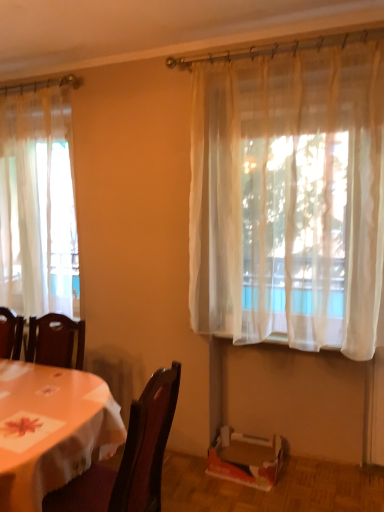
Question: From the image's perspective, would you say sheer white curtain at upper right, acting as the 1th curtain starting from the right, is positioned over sheer white curtain at left, which appears as the 2th curtain when viewed from the front?

Choices:
 (A) no
 (B) yes

Answer: (A)

Question: Is sheer white curtain at upper right, acting as the 1th curtain starting from the right, located outside sheer white curtain at left, positioned as the 2th curtain in right-to-left order?

Choices:
 (A) yes
 (B) no

Answer: (A)

Question: Can you confirm if sheer white curtain at upper right, which is the 2th curtain from left to right, is wider than sheer white curtain at left, which appears as the 2th curtain when viewed from the front?

Choices:
 (A) yes
 (B) no

Answer: (B)

Question: Can you confirm if sheer white curtain at upper right, which is the 2th curtain from left to right, is thinner than sheer white curtain at left, marked as the first curtain in a back-to-front arrangement?

Choices:
 (A) yes
 (B) no

Answer: (A)

Question: Is sheer white curtain at upper right, the 1th curtain positioned from the front, touching sheer white curtain at left, which appears as the 2th curtain when viewed from the front?

Choices:
 (A) yes
 (B) no

Answer: (B)

Question: Considering the relative positions of sheer white curtain at upper right, placed as the second curtain when sorted from back to front, and sheer white curtain at left, marked as the first curtain in a back-to-front arrangement, in the image provided, is sheer white curtain at upper right, placed as the second curtain when sorted from back to front, to the left of sheer white curtain at left, marked as the first curtain in a back-to-front arrangement, from the viewer's perspective?

Choices:
 (A) yes
 (B) no

Answer: (B)

Question: Does cardboard box at lower right have a larger size compared to wooden table at lower left?

Choices:
 (A) yes
 (B) no

Answer: (B)

Question: Is cardboard box at lower right touching wooden table at lower left?

Choices:
 (A) no
 (B) yes

Answer: (A)

Question: From the image's perspective, does cardboard box at lower right appear lower than wooden table at lower left?

Choices:
 (A) yes
 (B) no

Answer: (A)

Question: Considering the relative sizes of cardboard box at lower right and wooden table at lower left in the image provided, is cardboard box at lower right taller than wooden table at lower left?

Choices:
 (A) yes
 (B) no

Answer: (B)

Question: From the image's perspective, is cardboard box at lower right located above wooden table at lower left?

Choices:
 (A) yes
 (B) no

Answer: (B)

Question: Does cardboard box at lower right have a lesser width compared to wooden table at lower left?

Choices:
 (A) no
 (B) yes

Answer: (B)

Question: Considering the relative sizes of dark wood chair at lower left and cardboard box at lower right in the image provided, is dark wood chair at lower left shorter than cardboard box at lower right?

Choices:
 (A) yes
 (B) no

Answer: (B)